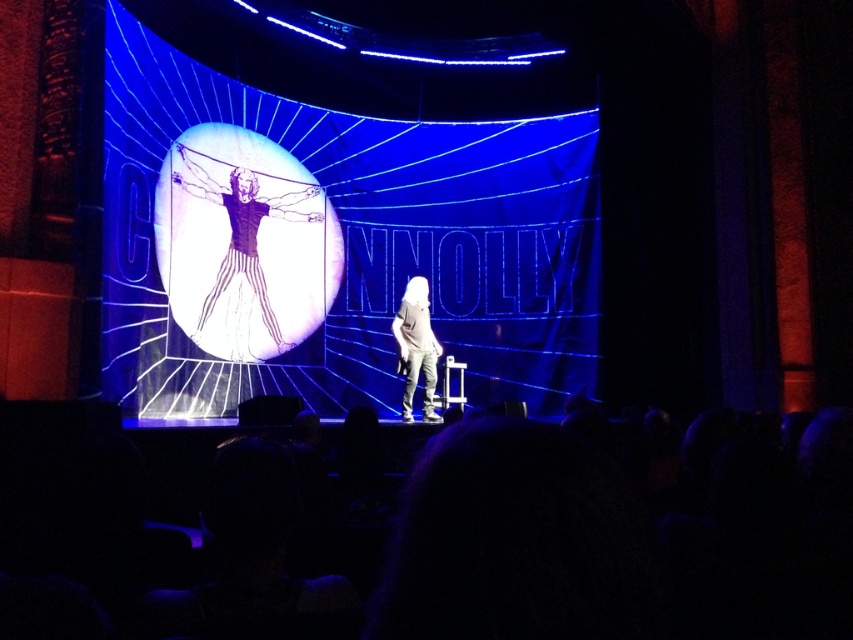
Question: Does translucent white figure at center appear on the right side of white cotton shirt at center?

Choices:
 (A) yes
 (B) no

Answer: (B)

Question: Does translucent white figure at center appear on the left side of white cotton shirt at center?

Choices:
 (A) yes
 (B) no

Answer: (A)

Question: Is white matte screen at center smaller than translucent white figure at center?

Choices:
 (A) no
 (B) yes

Answer: (A)

Question: Which object is positioned farthest from the translucent white figure at center?

Choices:
 (A) white matte screen at center
 (B) white cotton shirt at center

Answer: (B)

Question: Which point is farther to the camera?

Choices:
 (A) (242, 168)
 (B) (184, 204)
 (C) (399, 355)

Answer: (C)

Question: Which point is farther to the camera?

Choices:
 (A) white matte screen at center
 (B) white cotton shirt at center
 (C) translucent white figure at center

Answer: (B)